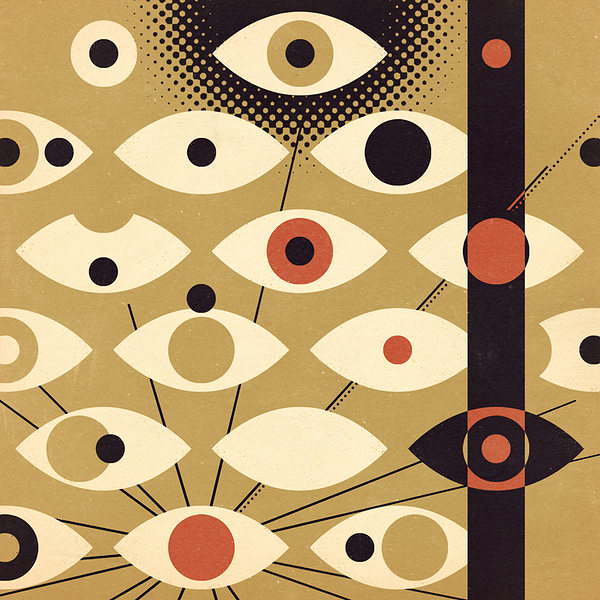
What are the coordinates of `tan background color to the right of black column` in the screenshot? It's located at (567, 68).